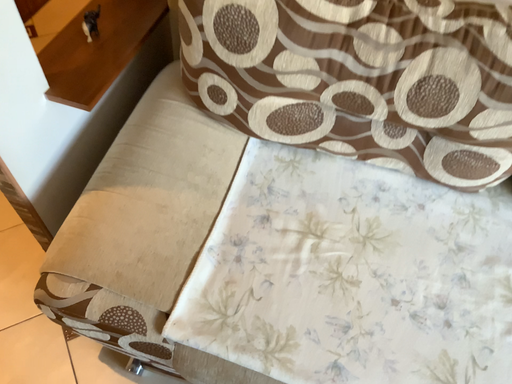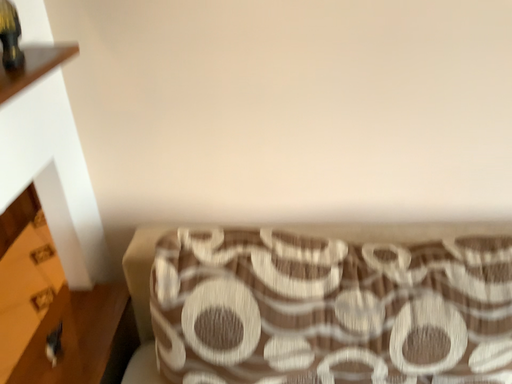
Question: Which way did the camera rotate in the video?

Choices:
 (A) rotated upward
 (B) rotated downward

Answer: (A)